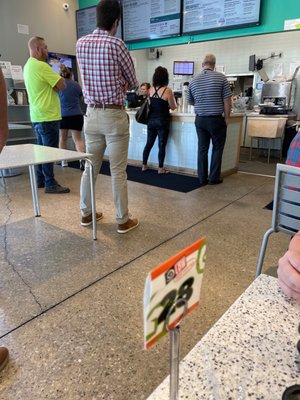
Locate an element on the screen. table is located at coordinates (29, 151), (244, 324).